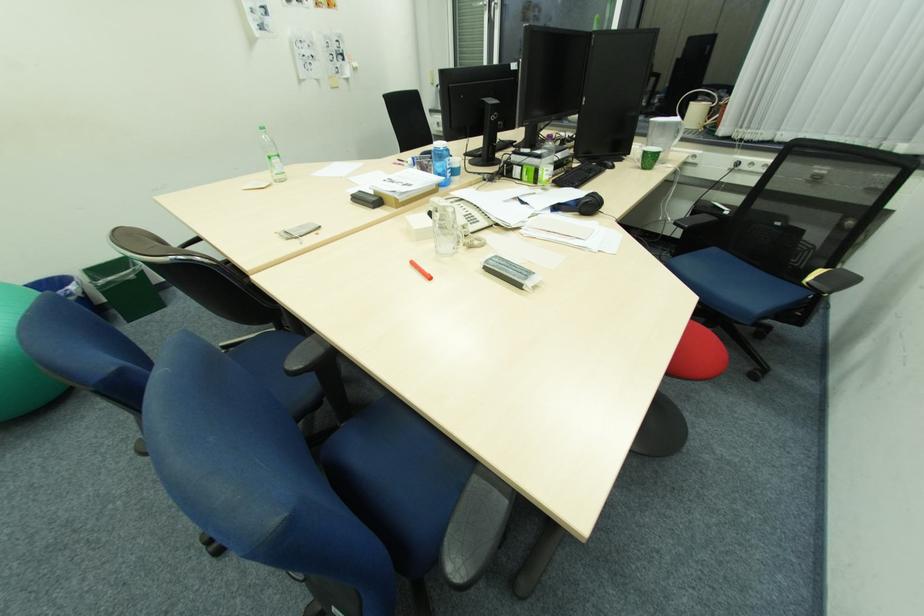
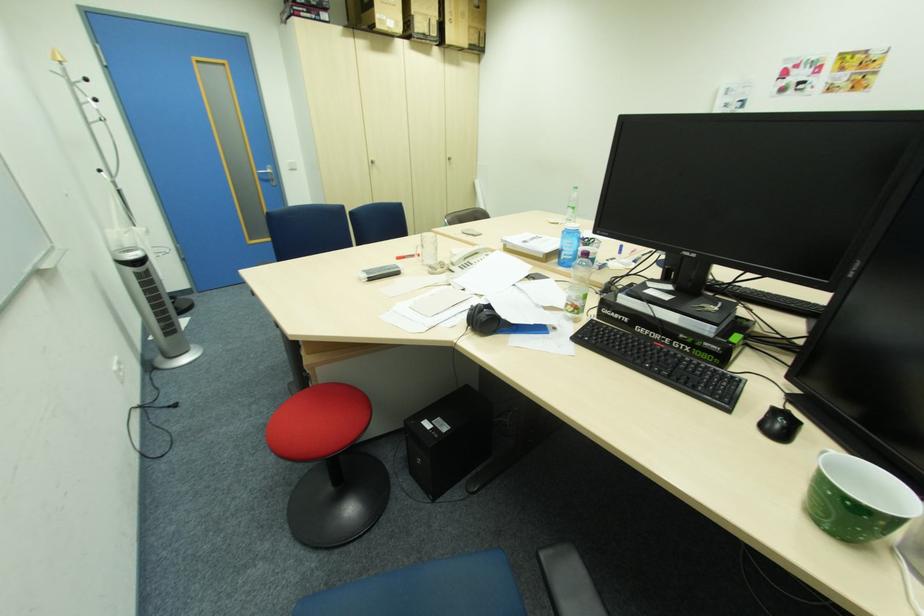
Where in the second image is the point corresponding to the point at 556,177 from the first image?

(575, 304)